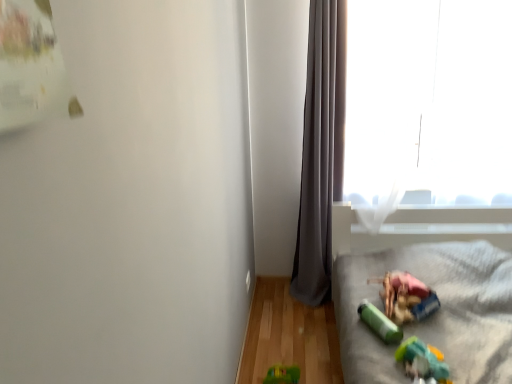
Describe the element at coordinates (429, 98) in the screenshot. I see `transparent glass window at upper right` at that location.

Locate an element on the screen. This screenshot has height=384, width=512. plush gray blanket at lower right is located at coordinates (432, 314).

Image resolution: width=512 pixels, height=384 pixels. Describe the element at coordinates (421, 360) in the screenshot. I see `plastic green toy at lower right, arranged as the 2th toy when viewed from the back` at that location.

Image resolution: width=512 pixels, height=384 pixels. What do you see at coordinates (321, 150) in the screenshot? I see `gray fabric curtain at right` at bounding box center [321, 150].

You are a GUI agent. You are given a task and a screenshot of the screen. Output one action in this format:
    pyautogui.click(x=<x>, y=<y>)
    Task: Click on the transparent glass window at upper right
    The width and height of the screenshot is (512, 384).
    Given the screenshot: What is the action you would take?
    pyautogui.click(x=429, y=98)

Which is in front, green plastic toy at lower right or gray fabric curtain at right?

green plastic toy at lower right is more forward.

Which object is thinner, green plastic toy at lower right or gray fabric curtain at right?

gray fabric curtain at right.

Is green plastic toy at lower right completely or partially outside of gray fabric curtain at right?

green plastic toy at lower right lies outside gray fabric curtain at right's area.

Considering the sizes of green plastic toy at lower right and gray fabric curtain at right in the image, is green plastic toy at lower right taller or shorter than gray fabric curtain at right?

Considering their sizes, green plastic toy at lower right has less height than gray fabric curtain at right.

You are a GUI agent. You are given a task and a screenshot of the screen. Output one action in this format:
    pyautogui.click(x=<x>, y=<y>)
    Task: Click on the stuff behind the plastic green toy at lower right, arranged as the 2th toy when viewed from the back
    The width and height of the screenshot is (512, 384).
    Given the screenshot: What is the action you would take?
    pyautogui.click(x=405, y=297)

From the image's perspective, would you say green plastic toy at lower right is shown under plastic green toy at lower right, the first toy when ordered from front to back?

No, from the image's perspective, green plastic toy at lower right is not beneath plastic green toy at lower right, the first toy when ordered from front to back.

Does point (314, 163) lie behind point (468, 342)?

Yes.

At what (x,y) coordinates should I click in order to perform the action: click on curtain above the plush gray blanket at lower right (from a real-world perspective). Please return your answer as a coordinate pair (x, y). Image resolution: width=512 pixels, height=384 pixels. Looking at the image, I should click on (321, 150).

From their relative heights in the image, would you say gray fabric curtain at right is taller or shorter than plush gray blanket at lower right?

Clearly, gray fabric curtain at right is taller compared to plush gray blanket at lower right.

Between gray fabric curtain at right and plush gray blanket at lower right, which one appears on the right side from the viewer's perspective?

From the viewer's perspective, plush gray blanket at lower right appears more on the right side.

Which is less distant, (430, 313) or (462, 258)?

The point (430, 313) is closer.

Is plush gray blanket at lower right surrounded by green plastic toy at lower right?

No, green plastic toy at lower right does not contain plush gray blanket at lower right.

Consider the image. How distant is green plastic toy at lower right from plush gray blanket at lower right?

They are 18.56 centimeters apart.

Would you consider green plastic toy at lower right to be distant from plush gray blanket at lower right?

green plastic toy at lower right is actually quite close to plush gray blanket at lower right.

How different are the orientations of green rubber toy at lower right, acting as the first toy starting from the back, and gray fabric curtain at right in degrees?

They differ by 25.2 degrees in their facing directions.

Considering the positions of objects green rubber toy at lower right, which appears as the second toy when viewed from the front, and gray fabric curtain at right in the image provided, who is more to the right, green rubber toy at lower right, which appears as the second toy when viewed from the front, or gray fabric curtain at right?

green rubber toy at lower right, which appears as the second toy when viewed from the front.

Considering the points (385, 340) and (341, 54), which point is behind, point (385, 340) or point (341, 54)?

The point (341, 54) is farther from the camera.

Considering the sizes of objects green rubber toy at lower right, which appears as the second toy when viewed from the front, and gray fabric curtain at right in the image provided, who is smaller, green rubber toy at lower right, which appears as the second toy when viewed from the front, or gray fabric curtain at right?

green rubber toy at lower right, which appears as the second toy when viewed from the front.

Is point (455, 325) farther from camera compared to point (475, 58)?

No, it is in front of (475, 58).

Does plush gray blanket at lower right have a greater height compared to transparent glass window at upper right?

No.

Is plush gray blanket at lower right far away from transparent glass window at upper right?

They are positioned close to each other.

From the picture: Considering the relative sizes of plush gray blanket at lower right and transparent glass window at upper right in the image provided, is plush gray blanket at lower right smaller than transparent glass window at upper right?

Incorrect, plush gray blanket at lower right is not smaller in size than transparent glass window at upper right.

How much distance is there between plastic green toy at lower right, the first toy when ordered from front to back, and green rubber toy at lower right, which appears as the second toy when viewed from the front?

They are 14.29 centimeters apart.

From the image's perspective, relative to green rubber toy at lower right, which appears as the second toy when viewed from the front, is plastic green toy at lower right, arranged as the 2th toy when viewed from the back, above or below?

Based on their image positions, plastic green toy at lower right, arranged as the 2th toy when viewed from the back, is located beneath green rubber toy at lower right, which appears as the second toy when viewed from the front.

Is plastic green toy at lower right, the first toy when ordered from front to back, next to green rubber toy at lower right, acting as the first toy starting from the back?

There is a gap between plastic green toy at lower right, the first toy when ordered from front to back, and green rubber toy at lower right, acting as the first toy starting from the back.

In the scene shown: How many degrees apart are the facing directions of plastic green toy at lower right, the first toy when ordered from front to back, and green rubber toy at lower right, acting as the first toy starting from the back?

plastic green toy at lower right, the first toy when ordered from front to back, and green rubber toy at lower right, acting as the first toy starting from the back, are facing 17.3 degrees away from each other.

This screenshot has width=512, height=384. I want to click on curtain on the left of green plastic toy at lower right, so click(x=321, y=150).

In the image, there is a plastic green toy at lower right, the first toy when ordered from front to back. Identify the location of stuff above it (from the image's perspective). This screenshot has width=512, height=384. (405, 297).

Which object lies nearer to the anchor point plush gray blanket at lower right, green rubber toy at lower right, acting as the first toy starting from the back, or gray fabric curtain at right?

Based on the image, green rubber toy at lower right, acting as the first toy starting from the back, appears to be nearer to plush gray blanket at lower right.

Based on their spatial positions, is plastic green toy at lower right, the first toy when ordered from front to back, or gray fabric curtain at right closer to green plastic toy at lower right?

The object closer to green plastic toy at lower right is plastic green toy at lower right, the first toy when ordered from front to back.

Considering their positions, is gray fabric curtain at right positioned further to plush gray blanket at lower right than green plastic toy at lower right?

gray fabric curtain at right is positioned further to the anchor plush gray blanket at lower right.

From the image, which object appears to be farther from green plastic toy at lower right, gray fabric curtain at right or green rubber toy at lower right, which appears as the second toy when viewed from the front?

gray fabric curtain at right is positioned further to the anchor green plastic toy at lower right.

Based on the photo, from the image, which object appears to be nearer to plastic green toy at lower right, the first toy when ordered from front to back, green plastic toy at lower right or transparent glass window at upper right?

green plastic toy at lower right is positioned closer to the anchor plastic green toy at lower right, the first toy when ordered from front to back.

Based on their spatial positions, is gray fabric curtain at right or plastic green toy at lower right, the first toy when ordered from front to back, further from green rubber toy at lower right, acting as the first toy starting from the back?

Based on the image, gray fabric curtain at right appears to be further to green rubber toy at lower right, acting as the first toy starting from the back.

Looking at this image, when comparing their distances from gray fabric curtain at right, does plush gray blanket at lower right or green plastic toy at lower right seem further?

Based on the image, green plastic toy at lower right appears to be further to gray fabric curtain at right.

Which object lies nearer to the anchor point green rubber toy at lower right, which appears as the second toy when viewed from the front, green plastic toy at lower right or plush gray blanket at lower right?

Among the two, green plastic toy at lower right is located nearer to green rubber toy at lower right, which appears as the second toy when viewed from the front.

Find the location of a particular element. Image resolution: width=512 pixels, height=384 pixels. stuff between gray fabric curtain at right and green rubber toy at lower right, which appears as the second toy when viewed from the front, in the up-down direction is located at coordinates (405, 297).

Where is `curtain between plush gray blanket at lower right and transparent glass window at upper right in the front-back direction`? The height and width of the screenshot is (384, 512). curtain between plush gray blanket at lower right and transparent glass window at upper right in the front-back direction is located at coordinates (321, 150).

At what (x,y) coordinates should I click in order to perform the action: click on stuff between transparent glass window at upper right and green rubber toy at lower right, acting as the first toy starting from the back, from top to bottom. Please return your answer as a coordinate pair (x, y). The image size is (512, 384). Looking at the image, I should click on (405, 297).

The width and height of the screenshot is (512, 384). I want to click on curtain that lies between transparent glass window at upper right and plastic green toy at lower right, arranged as the 2th toy when viewed from the back, from top to bottom, so click(321, 150).